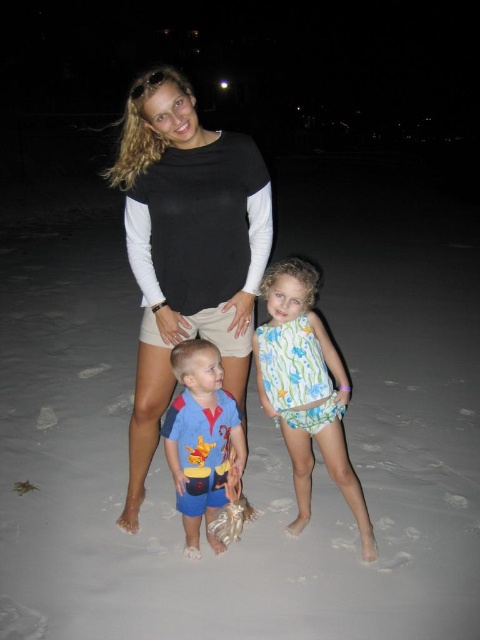
Who is higher up, black cotton shirt at center or blue cotton shirt at center?

black cotton shirt at center is above.

Where is `black cotton shirt at center`? The image size is (480, 640). black cotton shirt at center is located at coordinates (187, 248).

Which is in front, point (137, 419) or point (214, 435)?

Point (214, 435) is in front.

Identify the location of black cotton shirt at center. This screenshot has height=640, width=480. (187, 248).

Can you confirm if black cotton shirt at center is bigger than floral print swimsuit at center?

Correct, black cotton shirt at center is larger in size than floral print swimsuit at center.

Is black cotton shirt at center closer to the viewer compared to floral print swimsuit at center?

That is True.

Measure the distance between point (227, 164) and camera.

Point (227, 164) is 9.11 feet from camera.

This screenshot has width=480, height=640. I want to click on black cotton shirt at center, so click(187, 248).

Can you confirm if floral print swimsuit at center is positioned below blue cotton shirt at center?

Incorrect, floral print swimsuit at center is not positioned below blue cotton shirt at center.

Does point (312, 428) come farther from viewer compared to point (178, 369)?

Yes.

Is point (269, 300) closer to viewer compared to point (187, 448)?

Yes, it is in front of point (187, 448).

This screenshot has width=480, height=640. I want to click on floral print swimsuit at center, so [305, 388].